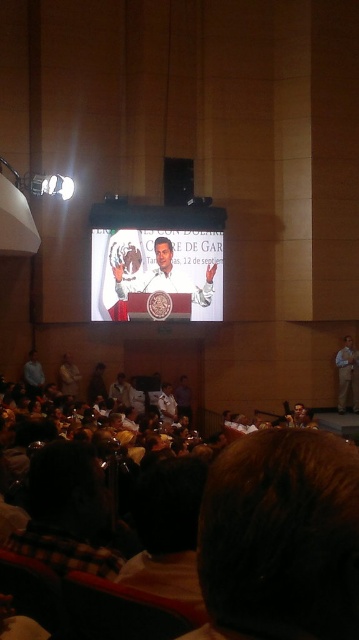
You are standing at the point marked as point (106, 260) in the conference hall. If you want to take a photo of the stage using a camera that has a maximum zoom range of 50 meters, will you be able to capture the entire stage clearly without moving closer?

The distance between point (106, 260) and the camera is 42.07 meters, which is within the camera maximum zoom range of 50 meters. Therefore, you can capture the entire stage clearly without moving closer.

You are a stagehand preparing to adjust the lighting for the event. You need to ensure that the spotlight reaches both the matte white podium at center and the khaki cotton pants at lower right. Considering their heights, which object should you adjust the spotlight to focus on first?

The matte white podium at center is taller than the khaki cotton pants at lower right, so you should adjust the spotlight to focus on the matte white podium at center first to ensure proper lighting coverage.